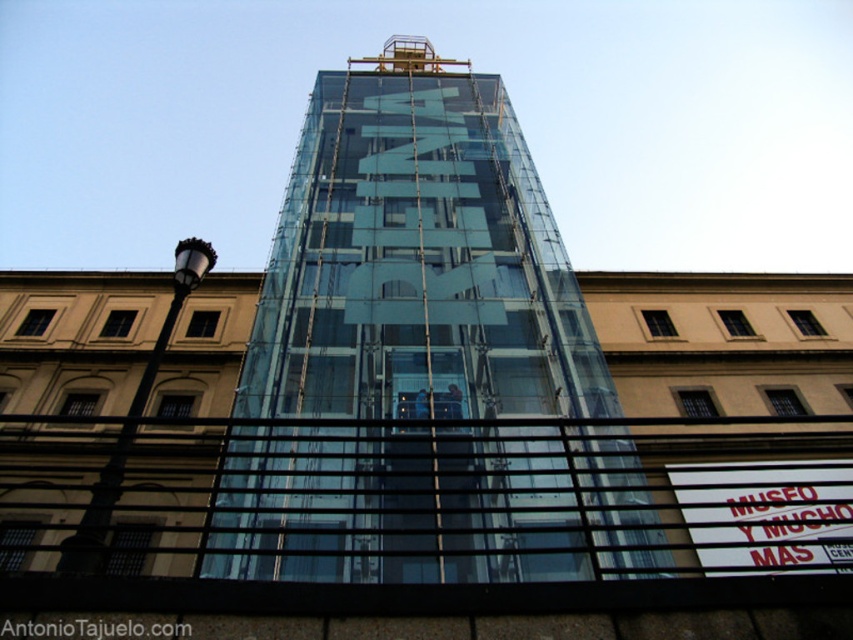
Question: Does transparent glass tower at center have a greater width compared to white plastic sign at lower right?

Choices:
 (A) yes
 (B) no

Answer: (B)

Question: Can you confirm if transparent glass tower at center is positioned to the left of white plastic sign at lower right?

Choices:
 (A) yes
 (B) no

Answer: (A)

Question: Does transparent glass tower at center appear on the left side of white plastic sign at lower right?

Choices:
 (A) yes
 (B) no

Answer: (A)

Question: Which point is farther from the camera taking this photo?

Choices:
 (A) (817, 516)
 (B) (271, 518)

Answer: (A)

Question: Which object is closer to the camera taking this photo?

Choices:
 (A) white plastic sign at lower right
 (B) transparent glass tower at center

Answer: (A)